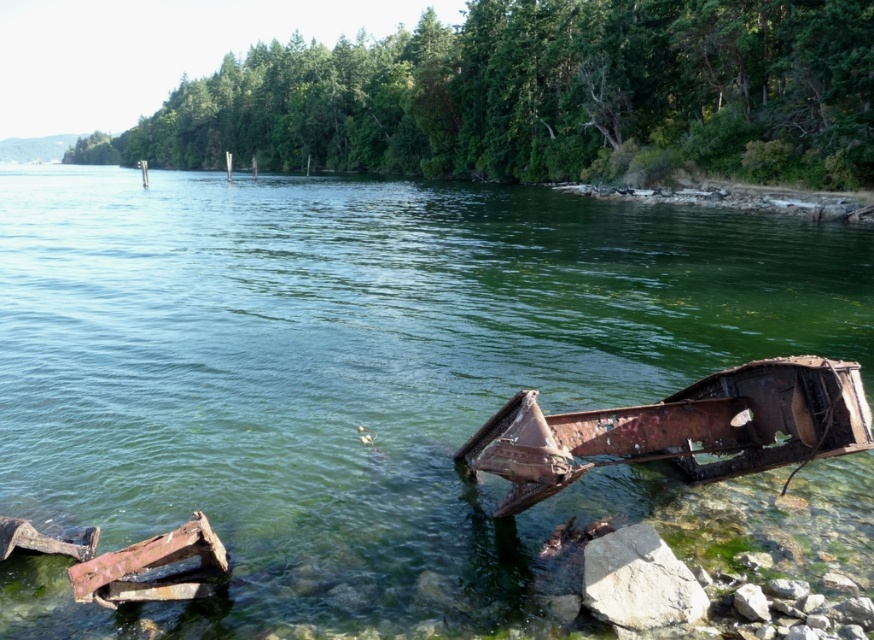
You are standing at the edge of the lake looking towards the submerged metal debris. There is a point marked at coordinates (383, 385). What object is located at this coordinate?

The point at coordinates (383, 385) marks the green rusty metal car at lower right.

You are a photographer standing at the lakeside and want to capture both point (847,364) and point (675,586) in your photo. Which point is closer to your camera lens?

Point (675,586) is closer to the camera lens because it is less further than point (847,364).

You are standing at the edge of the lake looking towards the submerged metal debris. There is a point marked at coordinates (x=383, y=385). What object is located at this point?

The point at coordinates (x=383, y=385) marks the location of the green rusty metal car at lower right.